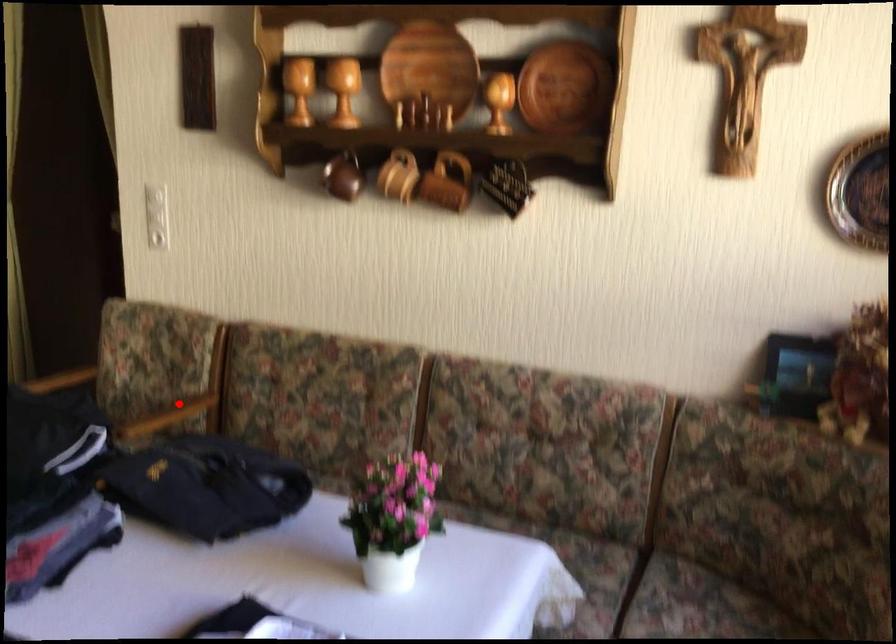
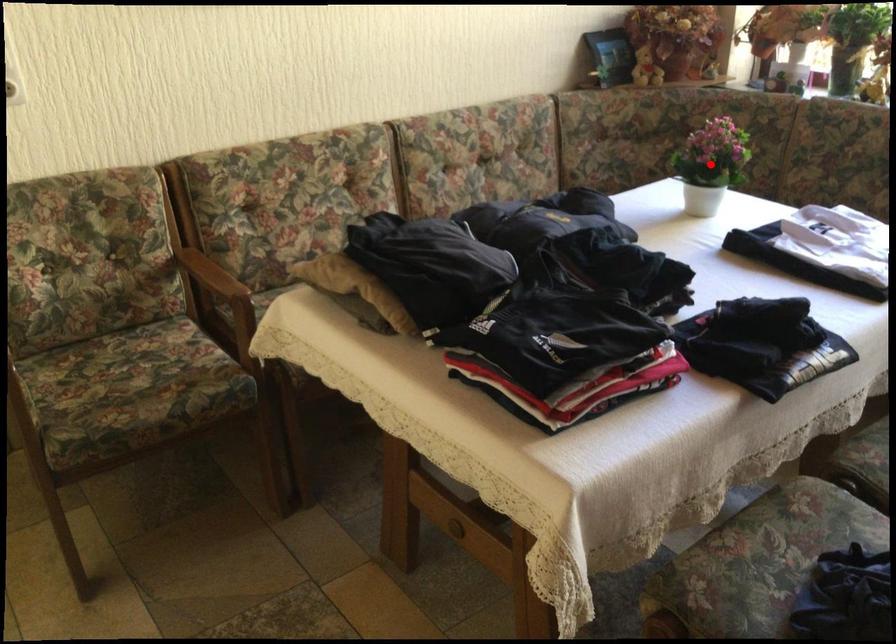
I am providing you with two images of the same scene from different viewpoints. A red point is marked on the first image and another point is marked on the second image. Is the red point in image1 aligned with the point shown in image2?

No